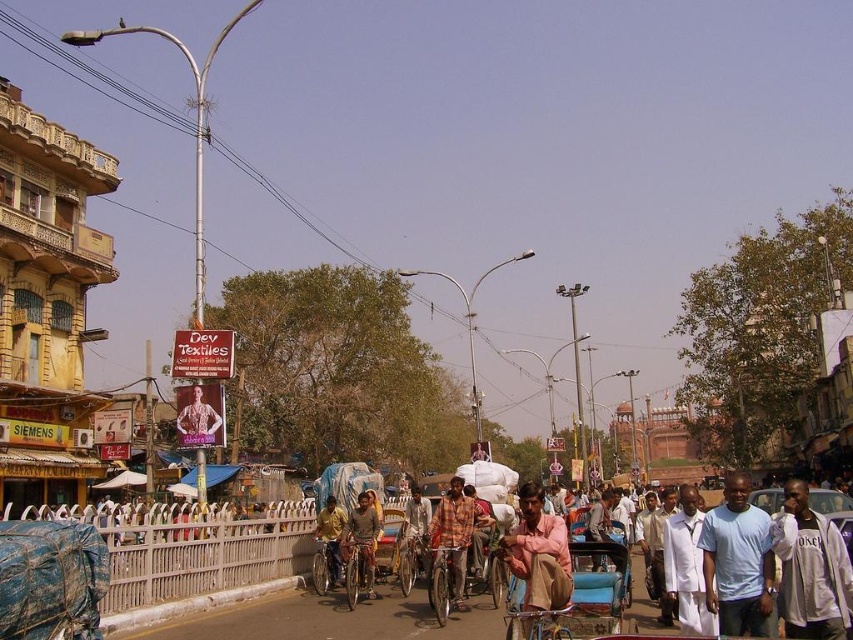
You are a photographer standing at the camera position. You want to capture a closeup shot of the light pink fabric at center. Can you estimate how far you need to walk forward to get the shot?

The light pink fabric at center is 52.02 meters away from the camera. To capture a closeup shot, you would need to walk forward approximately 52.02 meters to reach the fabric.

You are standing at the point with coordinates (453,534) in the image. What object are you standing on?

You are standing on the rustic wooden bicycle at center.